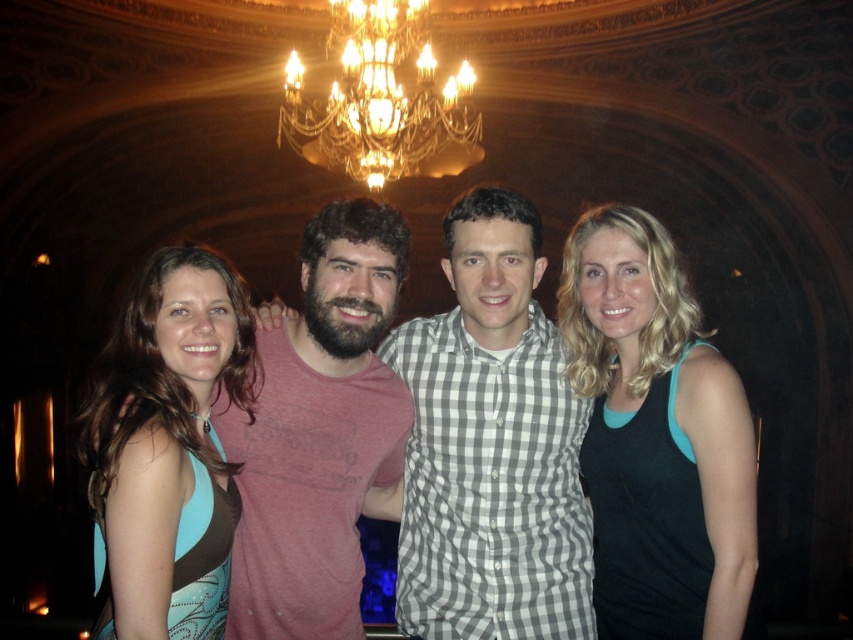
Question: Which object is farther from the camera taking this photo?

Choices:
 (A) black matte tank top at right
 (B) checkered fabric shirt at center
 (C) gold crystal chandelier at upper center

Answer: (C)

Question: Which of the following is the closest to the observer?

Choices:
 (A) blue fabric dress at left
 (B) gold crystal chandelier at upper center

Answer: (A)

Question: Is matte red t-shirt at center below blue fabric dress at left?

Choices:
 (A) yes
 (B) no

Answer: (B)

Question: Does black matte tank top at right come in front of matte red t-shirt at center?

Choices:
 (A) yes
 (B) no

Answer: (A)

Question: In this image, where is checkered fabric shirt at center located relative to matte red t-shirt at center?

Choices:
 (A) right
 (B) left

Answer: (A)

Question: Which is farther from the gold crystal chandelier at upper center?

Choices:
 (A) blue fabric dress at left
 (B) checkered fabric shirt at center

Answer: (A)